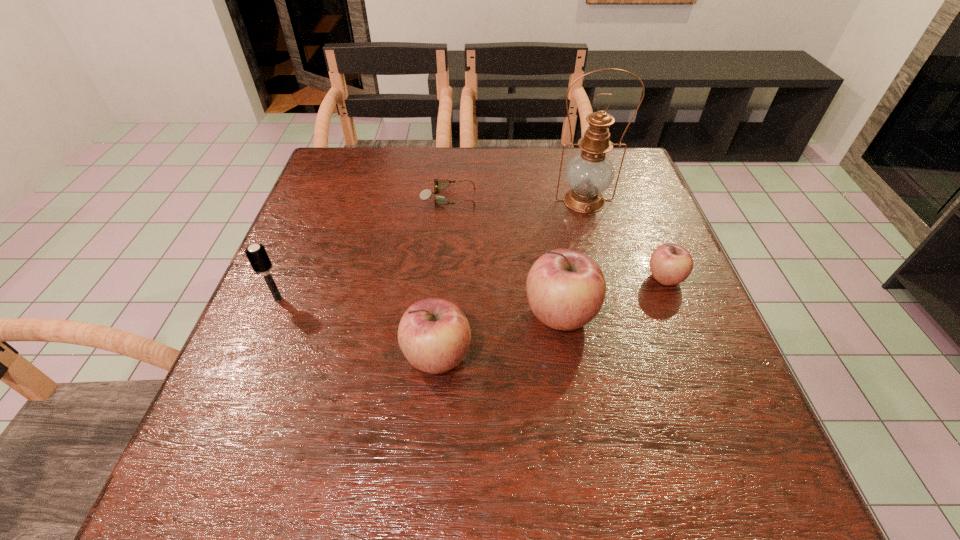
Please point a spot to add another apple on the left. Please provide its 2D coordinates. Your answer should be formatted as a tuple, i.e. [(x, y)], where the tuple contains the x and y coordinates of a point satisfying the conditions above.

[(292, 407)]